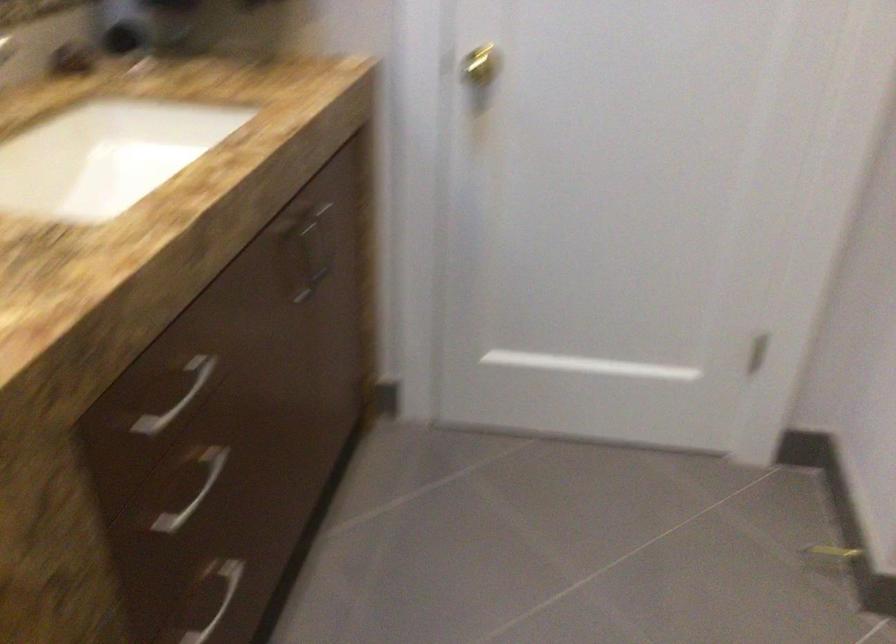
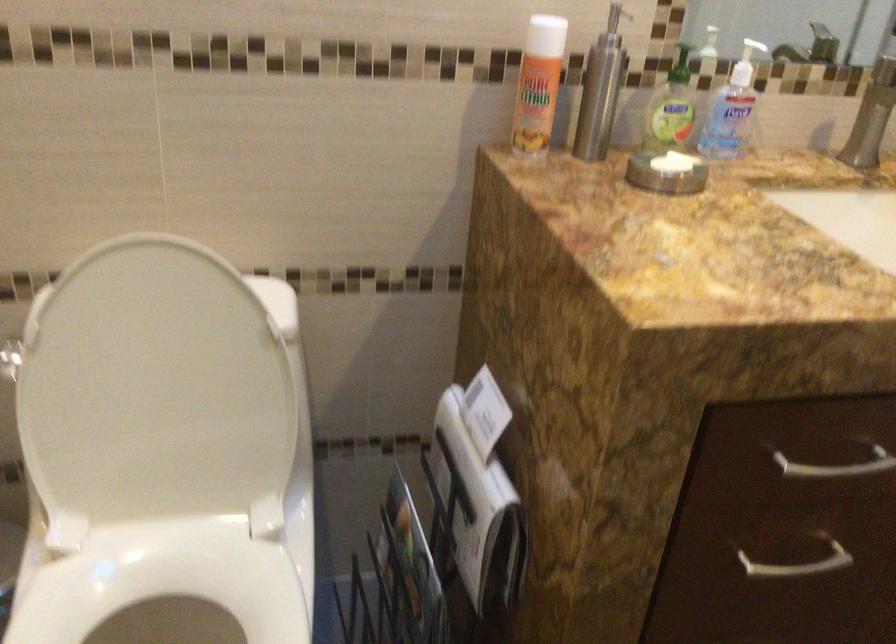
Locate, in the second image, the point that corresponds to the point at 176,397 in the first image.

(837, 466)